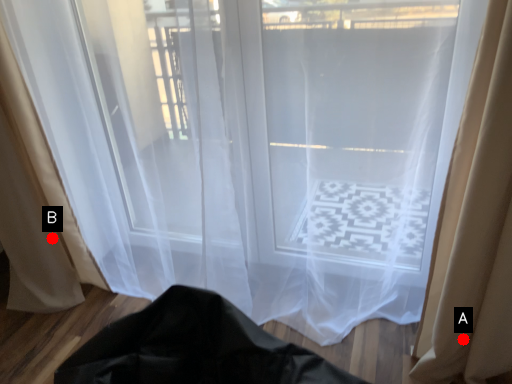
Question: Two points are circled on the image, labeled by A and B beside each circle. Which of the following is the farthest from the observer?

Choices:
 (A) A is further
 (B) B is further

Answer: (B)